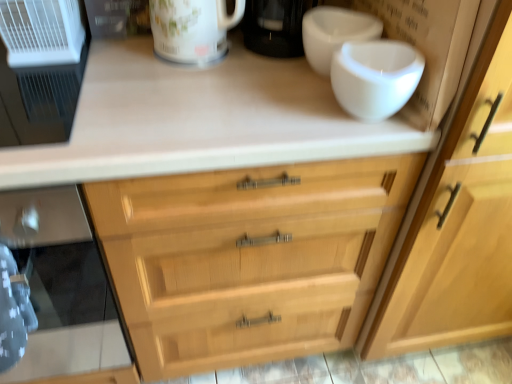
At what (x,y) coordinates should I click in order to perform the action: click on vacant point to the left of glossy ceramic mug at upper center. Please return your answer as a coordinate pair (x, y). Looking at the image, I should click on (126, 53).